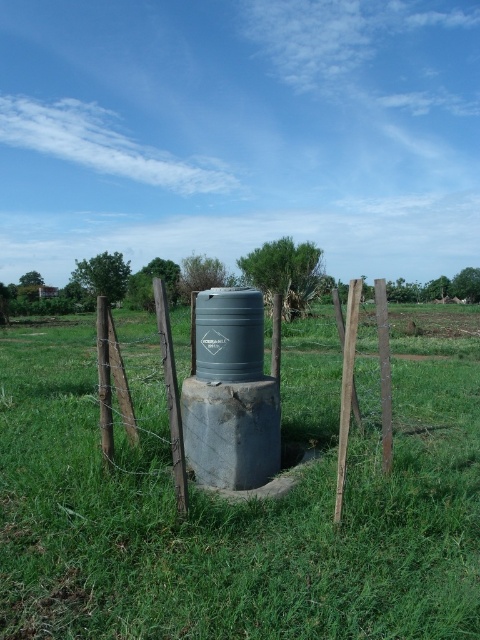
Question: Is green grassy at center bigger than wooden post at center?

Choices:
 (A) no
 (B) yes

Answer: (B)

Question: Is green grassy at center positioned behind wooden post at center?

Choices:
 (A) no
 (B) yes

Answer: (A)

Question: Which object appears farthest from the camera in this image?

Choices:
 (A) wooden post at center
 (B) green grassy at center

Answer: (A)

Question: Among these points, which one is farthest from the camera?

Choices:
 (A) (391, 397)
 (B) (132, 556)

Answer: (A)

Question: Can you confirm if green grassy at center is positioned below wooden post at center?

Choices:
 (A) yes
 (B) no

Answer: (A)